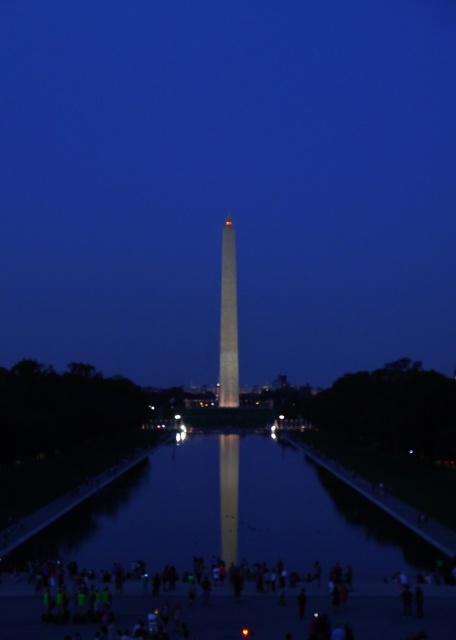
Question: Which of the following is the farthest from the observer?

Choices:
 (A) (182, 593)
 (B) (387, 531)
 (C) (231, 252)

Answer: (C)

Question: Can you confirm if glossy reflective water at center is positioned to the right of dark clothing figure at center?

Choices:
 (A) no
 (B) yes

Answer: (A)

Question: Observing the image, what is the correct spatial positioning of glossy reflective water at center in reference to shiny gold obelisk at center?

Choices:
 (A) left
 (B) right

Answer: (A)

Question: Among these points, which one is farthest from the camera?

Choices:
 (A) (236, 628)
 (B) (123, 545)
 (C) (234, 264)

Answer: (C)

Question: Which point is farther to the camera?

Choices:
 (A) (144, 465)
 (B) (150, 618)
 (C) (234, 397)

Answer: (C)

Question: Is glossy reflective water at center smaller than dark clothing figure at center?

Choices:
 (A) no
 (B) yes

Answer: (A)